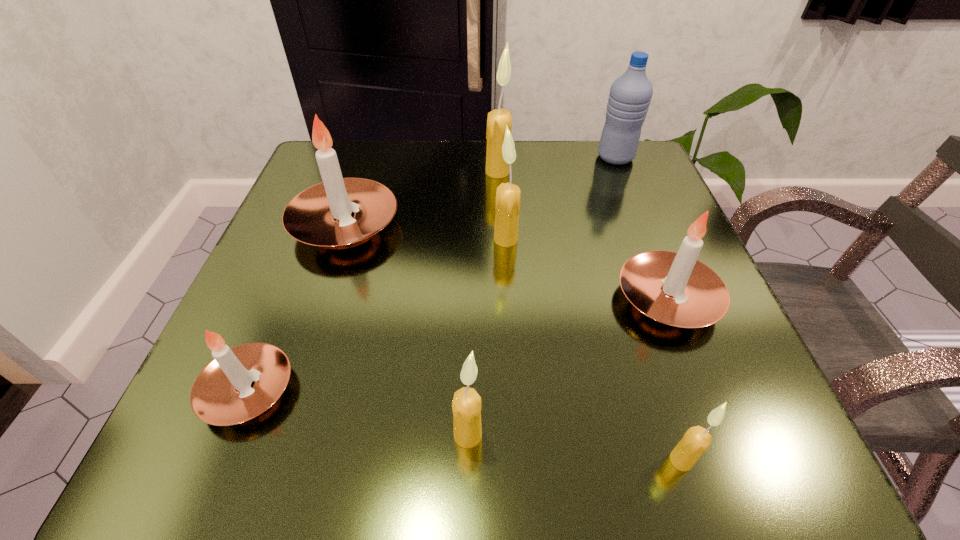
Locate an element on the screen. water bottle at the far edge is located at coordinates (630, 95).

Find the location of a particular element. The image size is (960, 540). water bottle that is at the right edge is located at coordinates (630, 95).

Find the location of `object that is positioned at the far left corner`. object that is positioned at the far left corner is located at coordinates (320, 215).

I want to click on object that is at the near left corner, so click(240, 383).

Where is `object at the far right corner`? object at the far right corner is located at coordinates (630, 95).

This screenshot has width=960, height=540. Find the location of `object that is at the near right corner`. object that is at the near right corner is located at coordinates (696, 440).

Where is `vacant area at the far edge of the desktop`? This screenshot has width=960, height=540. vacant area at the far edge of the desktop is located at coordinates 476,173.

In the image, there is a desktop. Identify the location of vacant space at the near edge. Image resolution: width=960 pixels, height=540 pixels. (388, 471).

Locate an element on the screen. This screenshot has height=540, width=960. vacant region at the left edge of the desktop is located at coordinates (276, 253).

Identify the location of vacant space at the right edge of the desktop. This screenshot has width=960, height=540. (737, 376).